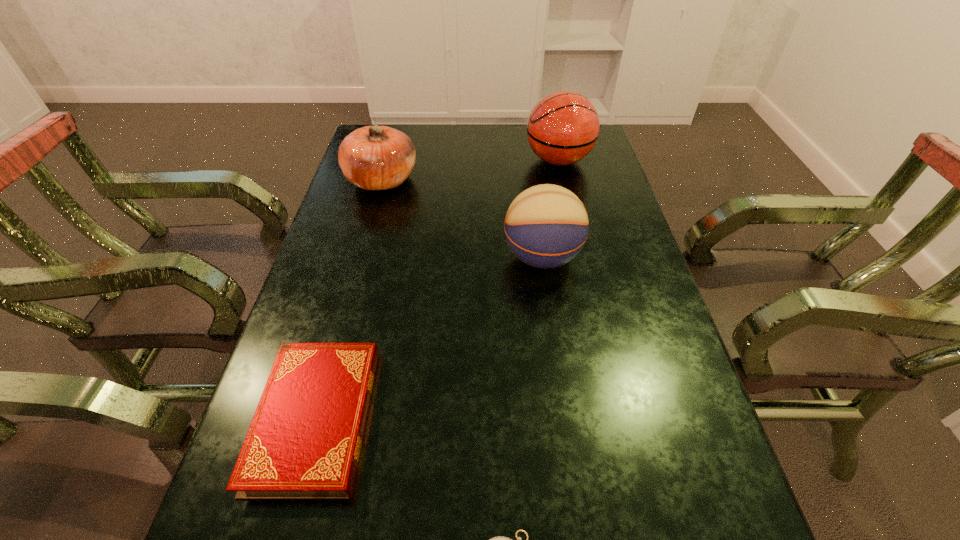
Find the location of a particular element. The width and height of the screenshot is (960, 540). the farther basketball is located at coordinates (563, 127).

Locate an element on the screen. the third nearest object is located at coordinates (546, 226).

The height and width of the screenshot is (540, 960). I want to click on pumpkin, so pyautogui.click(x=375, y=157).

Identify the location of hardback book. (304, 442).

Find the location of a particular element. the second nearest object is located at coordinates (304, 442).

Identify the location of free space located 0.160m on the side with spill of the farther basketball. (476, 160).

You are a GUI agent. You are given a task and a screenshot of the screen. Output one action in this format:
    pyautogui.click(x=<x>, y=<y>)
    Task: Click on the vacant space located on the side with spill of the farther basketball
    
    Given the screenshot: What is the action you would take?
    pyautogui.click(x=473, y=160)

Where is `free space located 0.340m on the side with spill of the farther basketball`? free space located 0.340m on the side with spill of the farther basketball is located at coordinates (421, 160).

Locate an element on the screen. vacant position located on the patterned surface of the third nearest object is located at coordinates (382, 257).

Where is `vacant space located on the patterned surface of the third nearest object`? The image size is (960, 540). vacant space located on the patterned surface of the third nearest object is located at coordinates (390, 257).